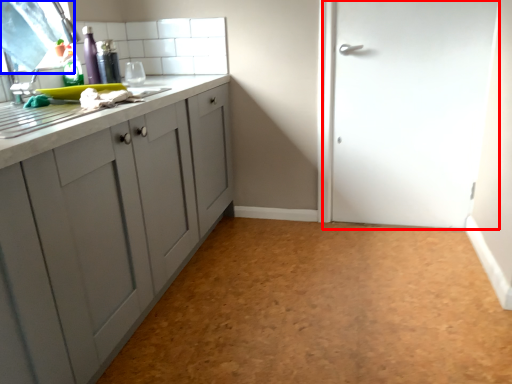
Question: Which point is closer to the camera, door (highlighted by a red box) or window screen (highlighted by a blue box)?

Choices:
 (A) door
 (B) window screen

Answer: (B)